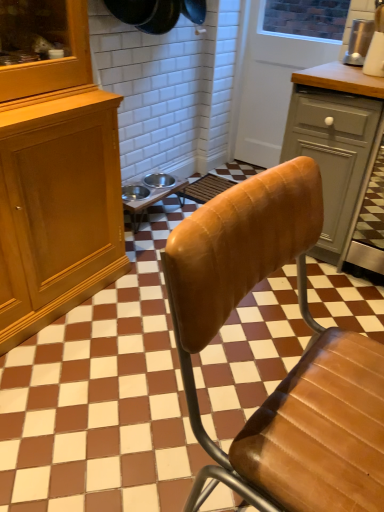
Describe the element at coordinates (359, 42) in the screenshot. I see `metallic silver appliance at upper right` at that location.

Describe the element at coordinates (281, 67) in the screenshot. I see `white wood screen door at upper center` at that location.

Where is `white wood screen door at upper center`? white wood screen door at upper center is located at coordinates (281, 67).

This screenshot has height=512, width=384. I want to click on metallic silver appliance at upper right, so click(x=359, y=42).

Does matte gray cabinet at right appear on the right side of metallic silver bowls at center?

Yes, matte gray cabinet at right is to the right of metallic silver bowls at center.

Is matte gray cabinet at right with metallic silver bowls at center?

matte gray cabinet at right and metallic silver bowls at center are not in contact.

Is matte gray cabinet at right aimed at metallic silver bowls at center?

No, matte gray cabinet at right is not turned towards metallic silver bowls at center.

Where is `cabinetry above the metallic silver bowls at center (from a real-world perspective)`? The width and height of the screenshot is (384, 512). cabinetry above the metallic silver bowls at center (from a real-world perspective) is located at coordinates (336, 143).

From a real-world perspective, which is physically below, metallic silver appliance at upper right or matte gray cabinet at right?

matte gray cabinet at right, from a real-world perspective.

Between metallic silver appliance at upper right and matte gray cabinet at right, which one appears on the left side from the viewer's perspective?

matte gray cabinet at right is more to the left.

Which point is more forward, (350, 50) or (339, 184)?

The point (339, 184) is closer.

Which object is further away from the camera taking this photo, metallic silver appliance at upper right or matte gray cabinet at right?

metallic silver appliance at upper right.

Considering the relative positions of metallic silver bowls at center and metallic silver appliance at upper right in the image provided, is metallic silver bowls at center behind metallic silver appliance at upper right?

Yes, metallic silver bowls at center is behind metallic silver appliance at upper right.

From the image's perspective, which one is positioned lower, metallic silver bowls at center or metallic silver appliance at upper right?

metallic silver bowls at center.

How different are the orientations of metallic silver bowls at center and metallic silver appliance at upper right in degrees?

The angular difference between metallic silver bowls at center and metallic silver appliance at upper right is 88 degrees.

From a real-world perspective, who is located lower, metallic silver bowls at center or metallic silver appliance at upper right?

metallic silver bowls at center.

From the image's perspective, between metallic silver bowls at center and matte gray cabinet at right, which one is located above?

matte gray cabinet at right appears higher in the image.

Measure the distance between metallic silver bowls at center and matte gray cabinet at right.

metallic silver bowls at center and matte gray cabinet at right are 99.02 centimeters apart from each other.

What's the angular difference between metallic silver bowls at center and matte gray cabinet at right's facing directions?

88.5 degrees separate the facing orientations of metallic silver bowls at center and matte gray cabinet at right.

Identify the location of cabinetry above the metallic silver bowls at center (from the image's perspective). (336, 143).

Identify the location of appliance that is above the metallic silver bowls at center (from the image's perspective). (359, 42).

Is metallic silver appliance at upper right facing towards metallic silver bowls at center?

No.

Looking at this image, how different are the orientations of metallic silver appliance at upper right and metallic silver bowls at center in degrees?

The angular difference between metallic silver appliance at upper right and metallic silver bowls at center is 88 degrees.

Does metallic silver appliance at upper right have a lesser height compared to metallic silver bowls at center?

In fact, metallic silver appliance at upper right may be taller than metallic silver bowls at center.

Is metallic silver appliance at upper right surrounding white wood screen door at upper center?

No, metallic silver appliance at upper right does not contain white wood screen door at upper center.

From the image's perspective, would you say metallic silver appliance at upper right is shown under white wood screen door at upper center?

Yes, from the image's perspective, metallic silver appliance at upper right is below white wood screen door at upper center.

In terms of width, does metallic silver appliance at upper right look wider or thinner when compared to white wood screen door at upper center?

Considering their sizes, metallic silver appliance at upper right looks broader than white wood screen door at upper center.

Can you tell me how much metallic silver appliance at upper right and white wood screen door at upper center differ in facing direction?

The angle between the facing direction of metallic silver appliance at upper right and the facing direction of white wood screen door at upper center is 1.87 degrees.

Considering the relative sizes of white wood screen door at upper center and metallic silver bowls at center in the image provided, is white wood screen door at upper center thinner than metallic silver bowls at center?

Yes, white wood screen door at upper center is thinner than metallic silver bowls at center.

Would you say white wood screen door at upper center contains metallic silver bowls at center?

No.

Based on the photo, which object is further away from the camera taking this photo, white wood screen door at upper center or metallic silver bowls at center?

white wood screen door at upper center.

From the image's perspective, is white wood screen door at upper center located above metallic silver bowls at center?

Yes.

Find the location of a particular element. The height and width of the screenshot is (512, 384). cabinetry above the metallic silver bowls at center (from a real-world perspective) is located at coordinates (336, 143).

Image resolution: width=384 pixels, height=512 pixels. Find the location of `appliance to the right of matte gray cabinet at right`. appliance to the right of matte gray cabinet at right is located at coordinates (359, 42).

Which object lies further to the anchor point metallic silver appliance at upper right, leather chair at center or white wood screen door at upper center?

leather chair at center.

When comparing their distances from matte gray cabinet at right, does leather chair at center or metallic silver appliance at upper right seem closer?

Based on the image, metallic silver appliance at upper right appears to be nearer to matte gray cabinet at right.

In the scene shown: Estimate the real-world distances between objects in this image. Which object is closer to leather chair at center, white wood screen door at upper center or metallic silver bowls at center?

metallic silver bowls at center is positioned closer to the anchor leather chair at center.

Looking at the image, which one is located closer to metallic silver bowls at center, matte gray cabinet at right or metallic silver appliance at upper right?

matte gray cabinet at right.

Based on their spatial positions, is matte gray cabinet at right or white wood screen door at upper center further from metallic silver appliance at upper right?

white wood screen door at upper center.

Estimate the real-world distances between objects in this image. Which object is closer to metallic silver appliance at upper right, white wood screen door at upper center or leather chair at center?

white wood screen door at upper center is positioned closer to the anchor metallic silver appliance at upper right.

Considering their positions, is white wood screen door at upper center positioned closer to metallic silver bowls at center than metallic silver appliance at upper right?

white wood screen door at upper center.

When comparing their distances from matte gray cabinet at right, does leather chair at center or metallic silver bowls at center seem closer?

metallic silver bowls at center is closer to matte gray cabinet at right.

Where is `appliance between matte gray cabinet at right and white wood screen door at upper center from front to back`? appliance between matte gray cabinet at right and white wood screen door at upper center from front to back is located at coordinates (359, 42).

Locate an element on the screen. cabinetry located between metallic silver bowls at center and metallic silver appliance at upper right in the left-right direction is located at coordinates pos(336,143).

The width and height of the screenshot is (384, 512). What are the coordinates of `screen door between metallic silver bowls at center and matte gray cabinet at right from left to right` in the screenshot? It's located at (281, 67).

Find the location of a particular element. cabinetry between leather chair at center and metallic silver bowls at center from front to back is located at coordinates (336, 143).